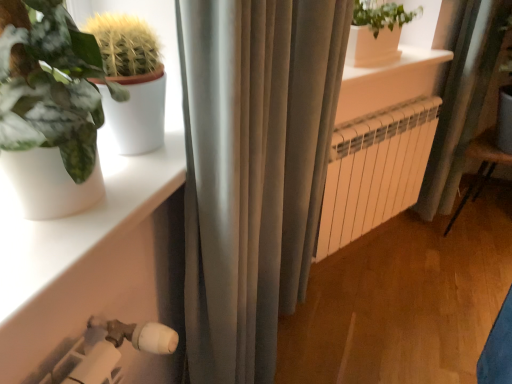
Question: Is white smooth window sill at upper center in front of or behind wooden armchair at lower right in the image?

Choices:
 (A) behind
 (B) front

Answer: (B)

Question: Looking at their shapes, would you say white smooth window sill at upper center is wider or thinner than wooden armchair at lower right?

Choices:
 (A) thin
 (B) wide

Answer: (A)

Question: Which object is positioned farthest from the white smooth window sill at upper center?

Choices:
 (A) white metallic radiator at center
 (B) wooden armchair at lower right
 (C) white matte shelf at lower left

Answer: (C)

Question: Which object is the farthest from the white metallic radiator at center?

Choices:
 (A) white smooth window sill at upper center
 (B) white matte shelf at lower left
 (C) wooden armchair at lower right

Answer: (B)